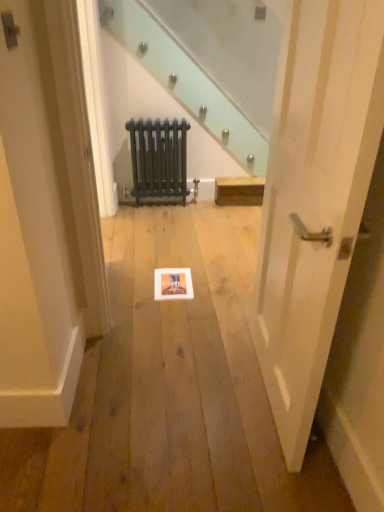
Question: Is white wood door at center at the left side of matte black radiator at center?

Choices:
 (A) no
 (B) yes

Answer: (A)

Question: From the image's perspective, is white wood door at center located beneath matte black radiator at center?

Choices:
 (A) yes
 (B) no

Answer: (A)

Question: Does white wood door at center lie behind matte black radiator at center?

Choices:
 (A) no
 (B) yes

Answer: (A)

Question: Considering the relative sizes of white wood door at center and matte black radiator at center in the image provided, is white wood door at center thinner than matte black radiator at center?

Choices:
 (A) yes
 (B) no

Answer: (B)

Question: Is white wood door at center located outside matte black radiator at center?

Choices:
 (A) no
 (B) yes

Answer: (B)

Question: Can you confirm if white wood door at center is bigger than matte black radiator at center?

Choices:
 (A) no
 (B) yes

Answer: (B)

Question: Is matte black radiator at center thinner than white wood door at center?

Choices:
 (A) no
 (B) yes

Answer: (B)

Question: Considering the relative sizes of matte black radiator at center and white wood door at center in the image provided, is matte black radiator at center taller than white wood door at center?

Choices:
 (A) no
 (B) yes

Answer: (A)

Question: Does matte black radiator at center have a greater width compared to white wood door at center?

Choices:
 (A) no
 (B) yes

Answer: (A)

Question: Is white wood door at center at the back of matte black radiator at center?

Choices:
 (A) yes
 (B) no

Answer: (B)

Question: From the image's perspective, is matte black radiator at center on top of white wood door at center?

Choices:
 (A) no
 (B) yes

Answer: (B)

Question: Would you say matte black radiator at center is a long distance from white wood door at center?

Choices:
 (A) no
 (B) yes

Answer: (B)

Question: From the image's perspective, relative to matte black radiator at center, is white wood door at center above or below?

Choices:
 (A) above
 (B) below

Answer: (B)